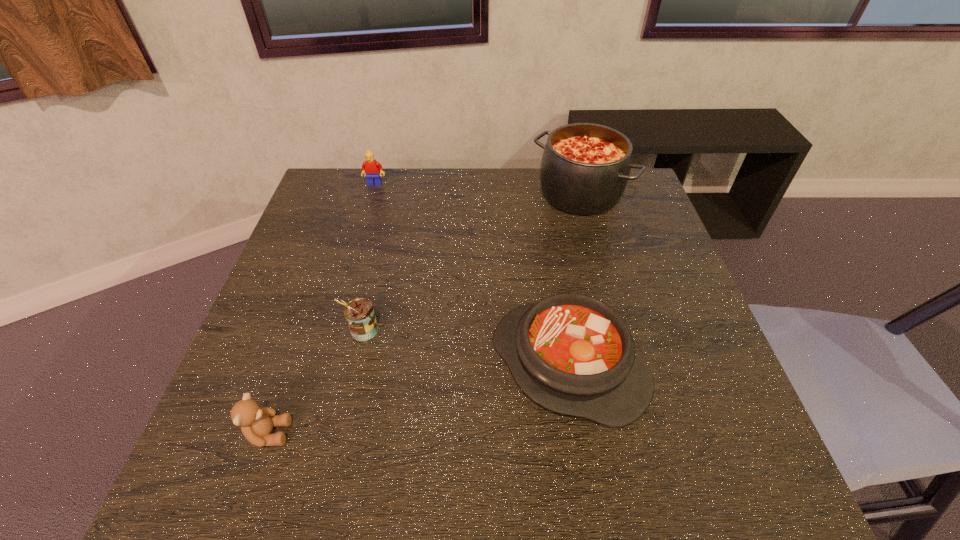
The width and height of the screenshot is (960, 540). Identify the location of the taller casserole. (585, 167).

At what (x,y) coordinates should I click in order to perform the action: click on the tallest object. Please return your answer as a coordinate pair (x, y). Image resolution: width=960 pixels, height=540 pixels. Looking at the image, I should click on (585, 167).

Find the location of a particular element. The width and height of the screenshot is (960, 540). Lego is located at coordinates (371, 168).

The image size is (960, 540). Find the location of `the nearer casserole`. the nearer casserole is located at coordinates (573, 354).

Locate an element on the screen. can is located at coordinates (359, 313).

Where is `teddy bear`? This screenshot has width=960, height=540. teddy bear is located at coordinates (256, 422).

I want to click on vacant area situated 0.110m on the left of the taller casserole, so click(496, 194).

Find the location of a particular element. The image size is (960, 540). free location located on the face of the Lego is located at coordinates (360, 237).

You are a GUI agent. You are given a task and a screenshot of the screen. Output one action in this format:
    pyautogui.click(x=<x>, y=<y>)
    Task: Click on the vacant space located 0.080m on the back of the nearer casserole
    This screenshot has height=540, width=960.
    Given the screenshot: What is the action you would take?
    pyautogui.click(x=556, y=286)

Locate an element on the screen. free region located 0.340m on the right of the can is located at coordinates (535, 330).